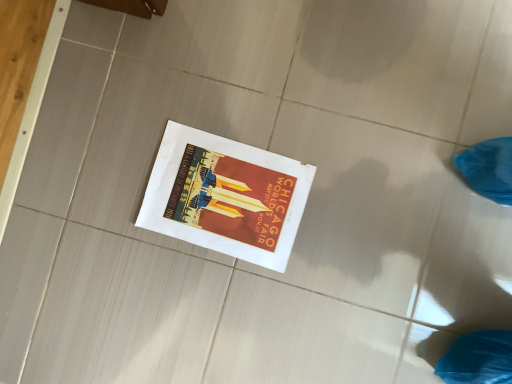
The width and height of the screenshot is (512, 384). I want to click on vacant area on the back side of white paper poster at center, so click(x=147, y=108).